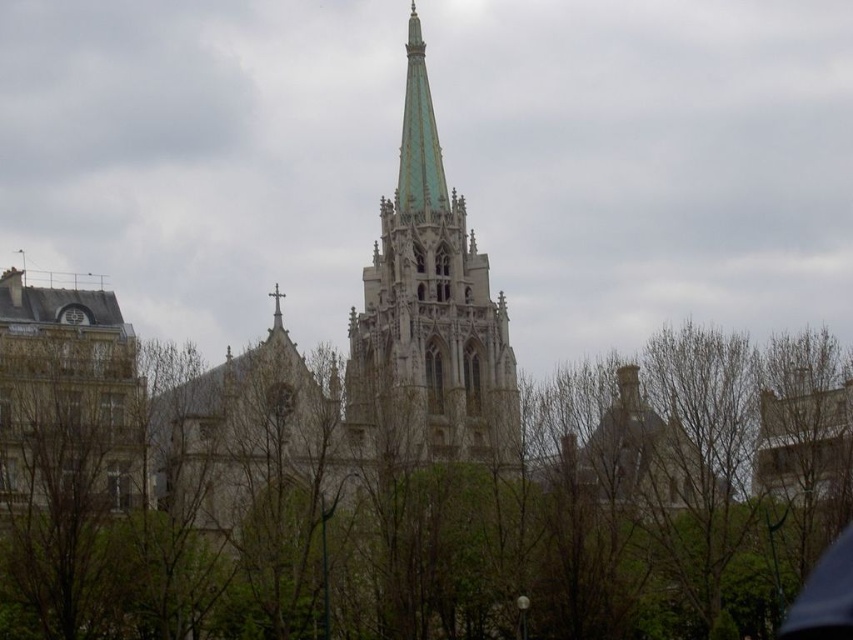
You are standing in the courtyard of the church and want to take a photo that includes both the green leafy tree at center and the green stone tower at center. The camera you have can focus on objects within a 10 meter range. Can you capture both in one shot without moving the camera?

The green leafy tree at center is 8.67 meters away from the green stone tower at center, which is within the 10 meter range of the camera. Therefore, you can capture both in one shot without moving the camera.

You are standing in front of the Gothic church spire and want to take a photo that includes both the green leafy tree at center and the green stone tower at center. Which one of these two objects will appear taller in the photo?

The green stone tower at center will appear taller in the photo because it is taller than the green leafy tree at center according to the description.